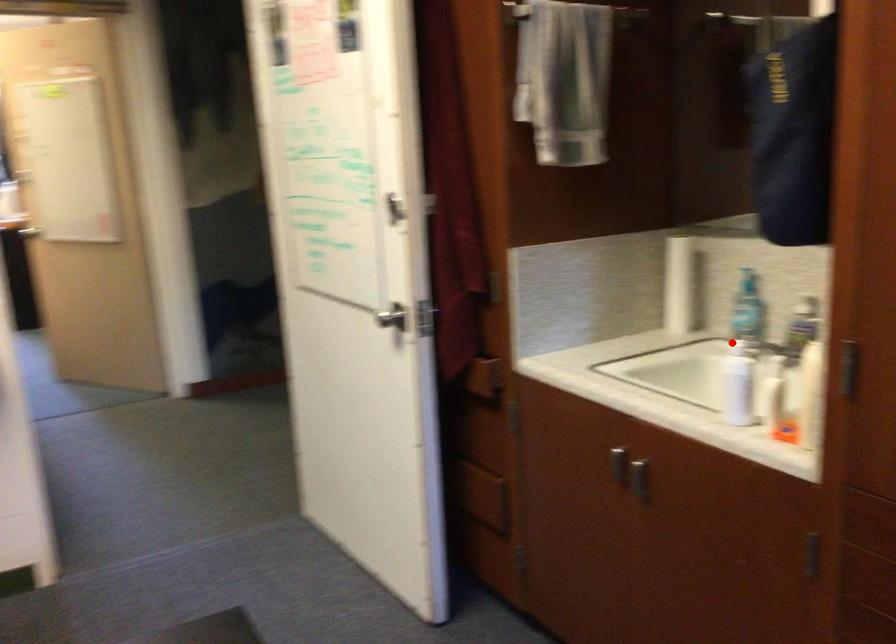
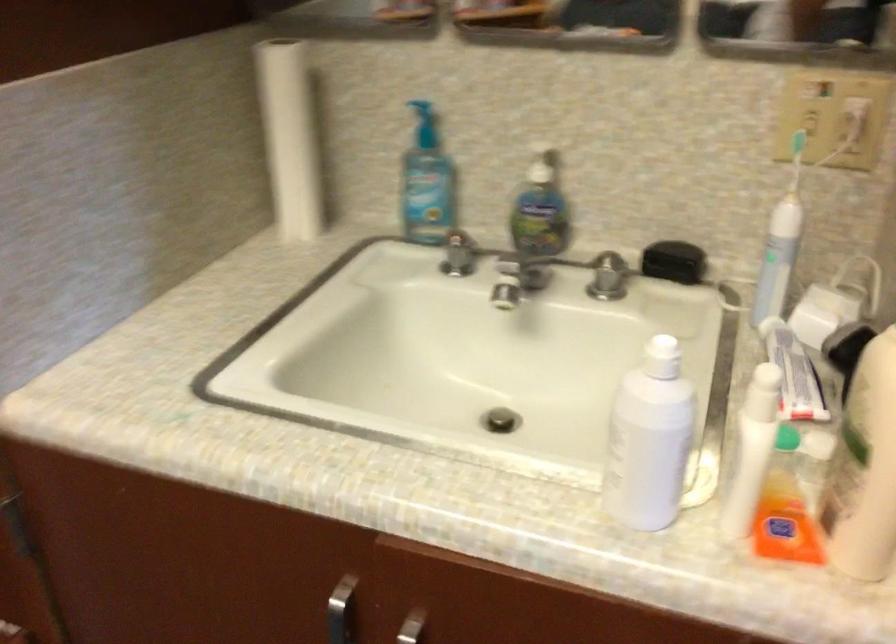
In the second image, find the point that corresponds to the highlighted location in the first image.

(661, 357)